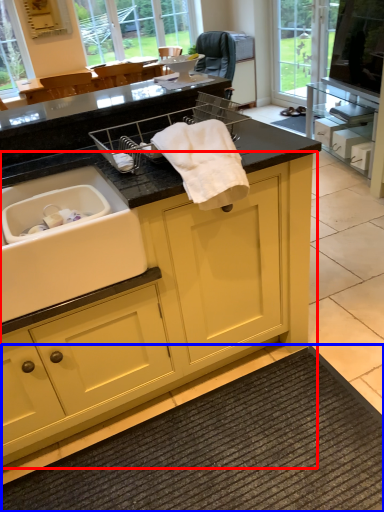
Question: Among these objects, which one is farthest to the camera, cabinetry (highlighted by a red box) or bath mat (highlighted by a blue box)?

Choices:
 (A) cabinetry
 (B) bath mat

Answer: (B)